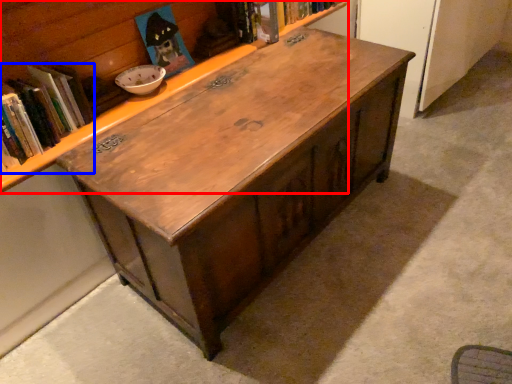
Question: Which object appears farthest to the camera in this image, bookcase (highlighted by a red box) or book (highlighted by a blue box)?

Choices:
 (A) bookcase
 (B) book

Answer: (B)